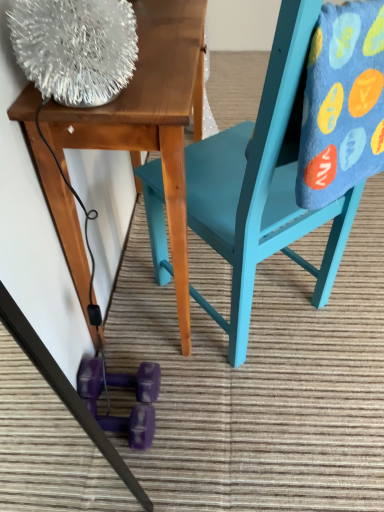
Find the location of a particular element. The height and width of the screenshot is (512, 384). free point below teal painted wood chair at center (from a real-world perspective) is located at coordinates (264, 306).